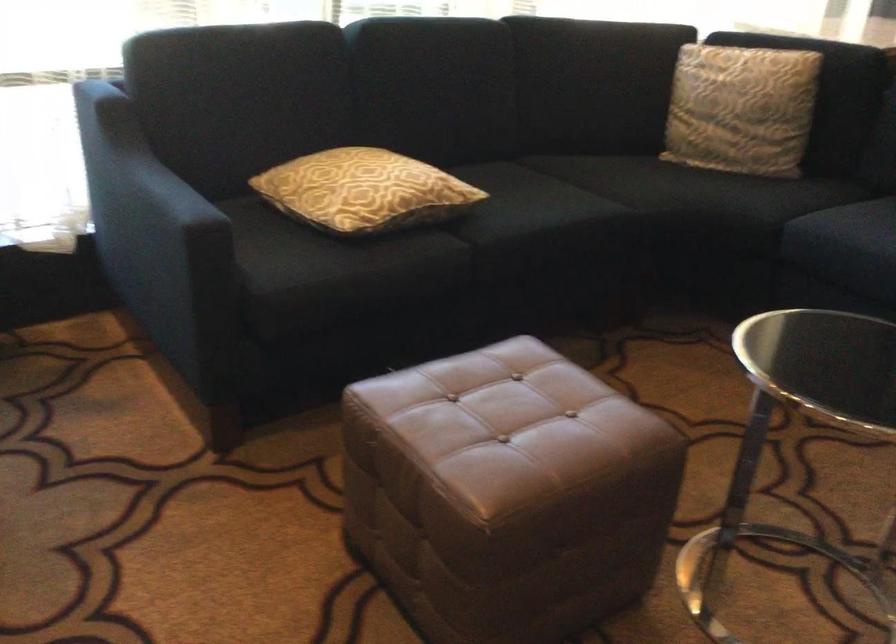
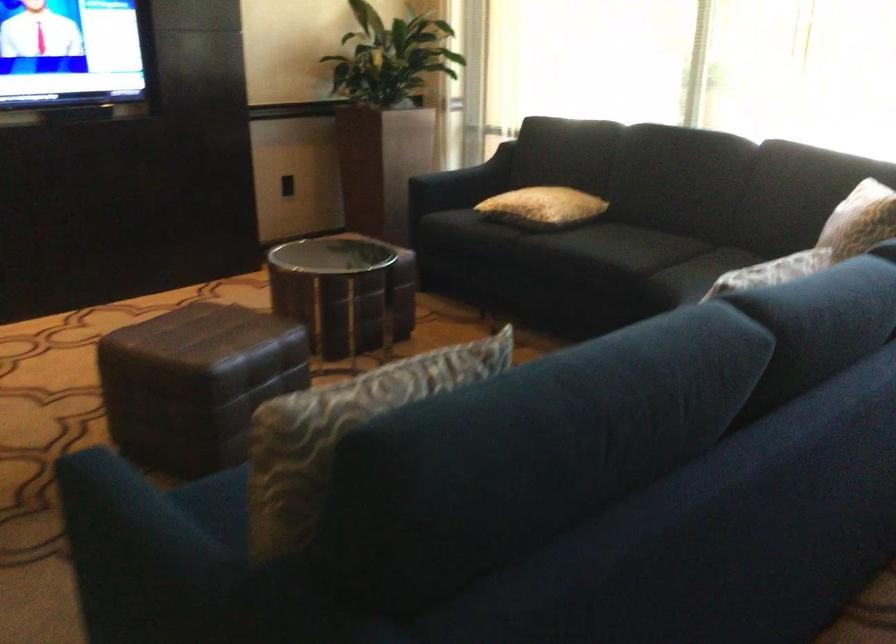
Where in the second image is the point corresponding to the point at 426,187 from the first image?

(543, 207)